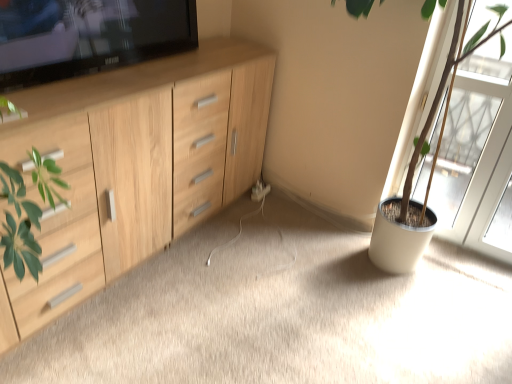
Question: Is transparent glass screen door at right to the right of white plastic electric outlet at center from the viewer's perspective?

Choices:
 (A) no
 (B) yes

Answer: (B)

Question: Considering the relative positions of transparent glass screen door at right and white plastic electric outlet at center in the image provided, is transparent glass screen door at right to the left of white plastic electric outlet at center from the viewer's perspective?

Choices:
 (A) no
 (B) yes

Answer: (A)

Question: Is transparent glass screen door at right further to camera compared to white plastic electric outlet at center?

Choices:
 (A) yes
 (B) no

Answer: (B)

Question: Is transparent glass screen door at right far from white plastic electric outlet at center?

Choices:
 (A) yes
 (B) no

Answer: (A)

Question: Does transparent glass screen door at right have a greater height compared to white plastic electric outlet at center?

Choices:
 (A) no
 (B) yes

Answer: (B)

Question: Is transparent glass screen door at right located outside white plastic electric outlet at center?

Choices:
 (A) yes
 (B) no

Answer: (A)

Question: From the image's perspective, is wooden cabinet at left located beneath white plastic electric outlet at center?

Choices:
 (A) no
 (B) yes

Answer: (B)

Question: Considering the relative sizes of wooden cabinet at left and white plastic electric outlet at center in the image provided, is wooden cabinet at left thinner than white plastic electric outlet at center?

Choices:
 (A) no
 (B) yes

Answer: (A)

Question: Does wooden cabinet at left appear on the left side of white plastic electric outlet at center?

Choices:
 (A) no
 (B) yes

Answer: (A)

Question: From the image's perspective, is wooden cabinet at left over white plastic electric outlet at center?

Choices:
 (A) yes
 (B) no

Answer: (B)

Question: Considering the relative sizes of wooden cabinet at left and white plastic electric outlet at center in the image provided, is wooden cabinet at left smaller than white plastic electric outlet at center?

Choices:
 (A) yes
 (B) no

Answer: (B)

Question: Is wooden cabinet at left touching white plastic electric outlet at center?

Choices:
 (A) yes
 (B) no

Answer: (B)

Question: Is green matte plant pot at right outside white plastic electric outlet at center?

Choices:
 (A) no
 (B) yes

Answer: (B)